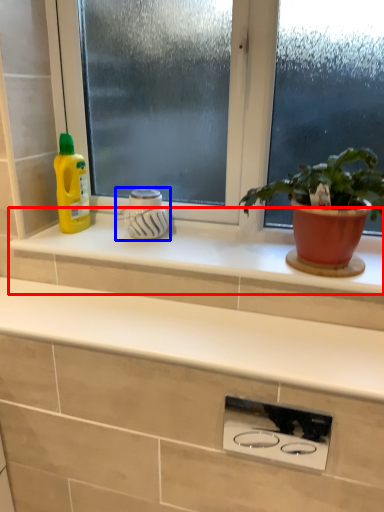
Question: Which object appears closest to the camera in this image, window sill (highlighted by a red box) or appliance (highlighted by a blue box)?

Choices:
 (A) window sill
 (B) appliance

Answer: (A)